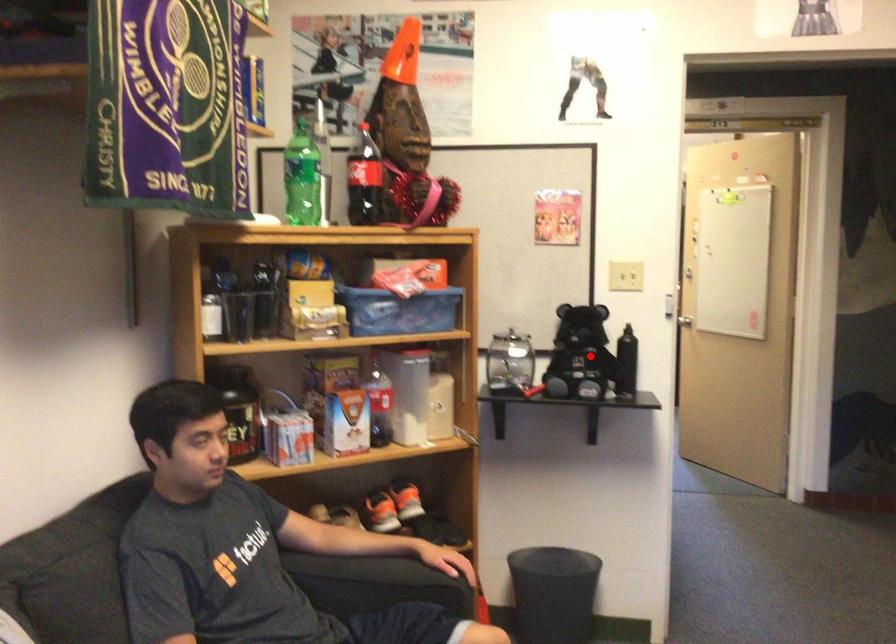
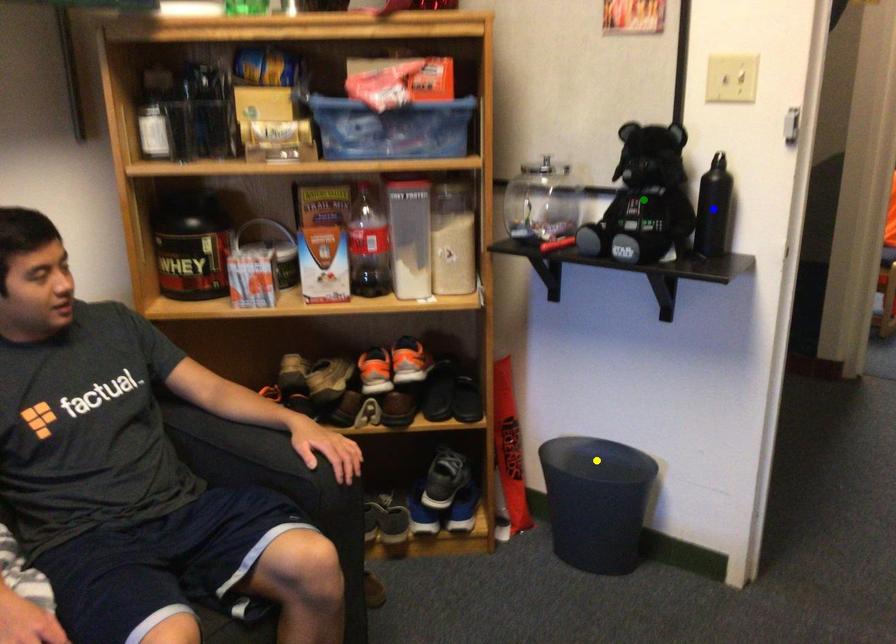
Question: I am providing you with two images of the same scene from different viewpoints. A red point is marked on the first image. You are given multiple points on the second image. Can you choose the point in image 2 that corresponds to the point in image 1?

Choices:
 (A) green point
 (B) yellow point
 (C) blue point

Answer: (A)